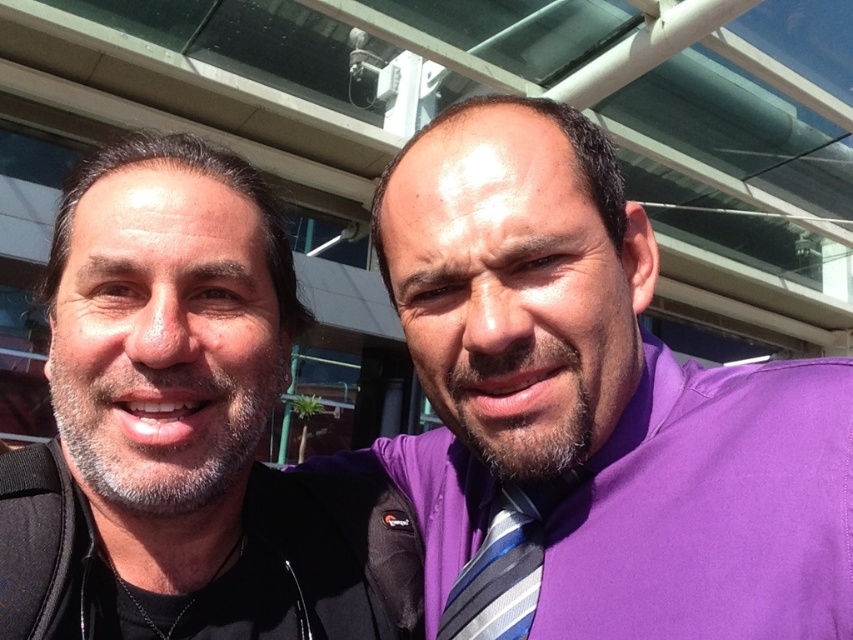
Question: Based on their relative distances, which object is farther from the black matte jacket at left?

Choices:
 (A) purple fabric shirt at right
 (B) black softshell jacket at left

Answer: (A)

Question: Can you confirm if purple fabric shirt at right is smaller than black matte jacket at left?

Choices:
 (A) no
 (B) yes

Answer: (A)

Question: Which point is closer to the camera?

Choices:
 (A) purple fabric shirt at right
 (B) striped fabric tie at center
 (C) black matte jacket at left

Answer: (A)

Question: Which of the following is the farthest from the observer?

Choices:
 (A) (442, 612)
 (B) (689, 496)
 (C) (97, 618)
 (D) (263, 563)

Answer: (A)

Question: Is black softshell jacket at left thinner than striped fabric tie at center?

Choices:
 (A) yes
 (B) no

Answer: (B)

Question: Does purple fabric shirt at right have a greater width compared to black softshell jacket at left?

Choices:
 (A) no
 (B) yes

Answer: (B)